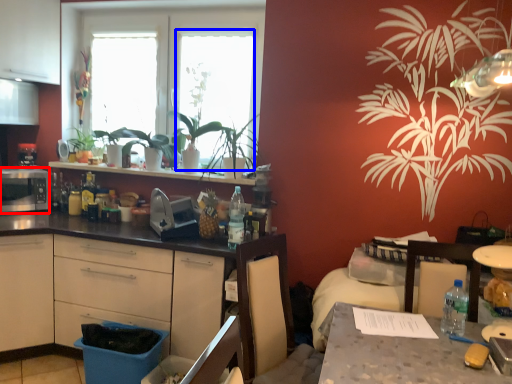
Question: Among these objects, which one is nearest to the camera, appliance (highlighted by a red box) or window screen (highlighted by a blue box)?

Choices:
 (A) appliance
 (B) window screen

Answer: (A)